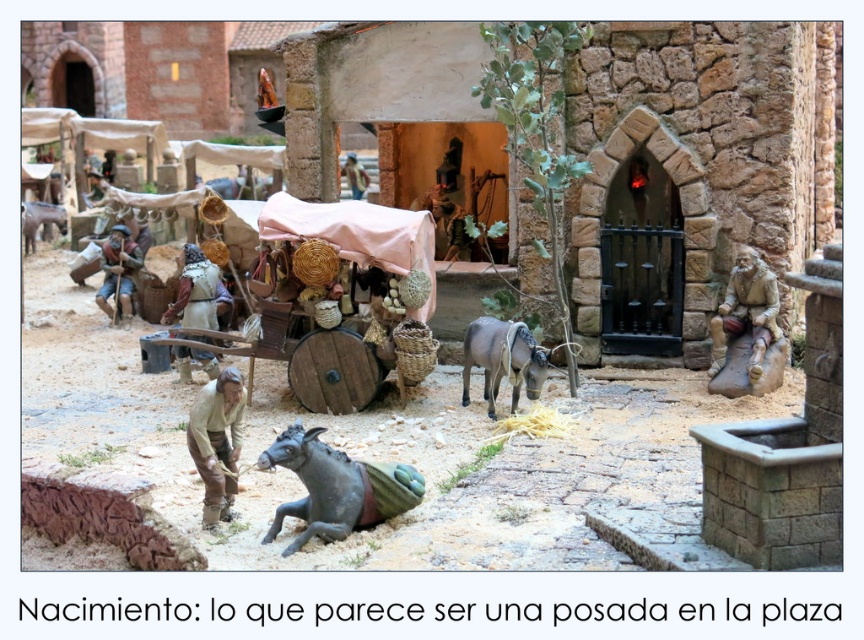
Can you confirm if gray matte donkey at center is positioned to the left of gray matte donkey at left?

In fact, gray matte donkey at center is to the right of gray matte donkey at left.

Who is positioned more to the left, gray matte donkey at center or gray matte donkey at left?

Positioned to the left is gray matte donkey at left.

Which is in front, point (484, 387) or point (46, 204)?

Point (484, 387)

Identify the location of gray matte donkey at center. (503, 360).

Can you confirm if black matte donkey at lower center is wider than gray matte donkey at left?

Yes.

Does black matte donkey at lower center appear on the right side of gray matte donkey at left?

Yes, black matte donkey at lower center is to the right of gray matte donkey at left.

Who is more forward, [274,440] or [49,220]?

Point [274,440] is more forward.

Where is `black matte donkey at lower center`? This screenshot has width=864, height=640. black matte donkey at lower center is located at coordinates (335, 486).

Does black matte donkey at lower center come in front of gray matte donkey at center?

Yes.

Can you confirm if black matte donkey at lower center is shorter than gray matte donkey at center?

Yes, black matte donkey at lower center is shorter than gray matte donkey at center.

What do you see at coordinates (335, 486) in the screenshot? The image size is (864, 640). I see `black matte donkey at lower center` at bounding box center [335, 486].

The height and width of the screenshot is (640, 864). What are the coordinates of `black matte donkey at lower center` in the screenshot? It's located at (335, 486).